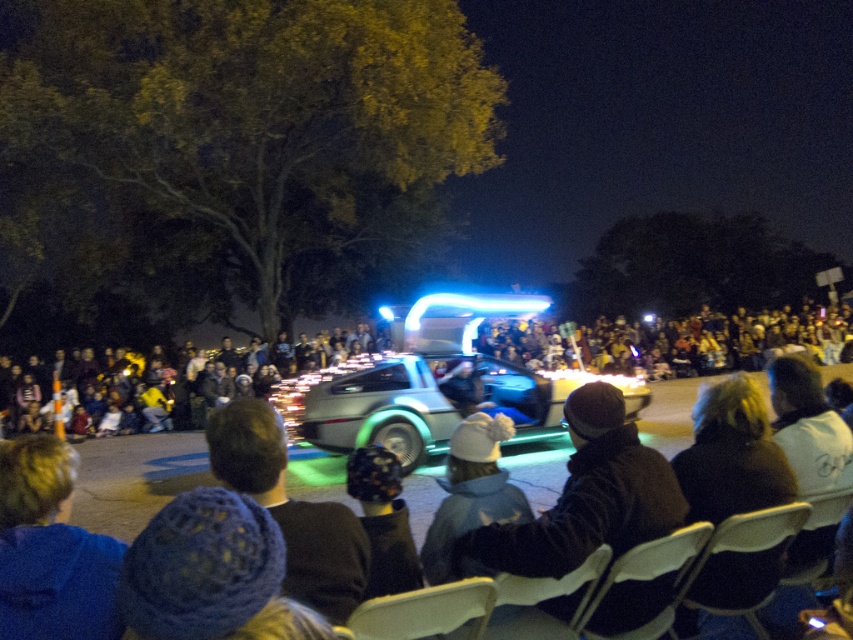
Question: Which object is farther from the camera taking this photo?

Choices:
 (A) blue knitted hat at lower center
 (B) knitted wool hat at center
 (C) white cotton shirt at lower right

Answer: (C)

Question: Does blue knitted hat at lower center have a larger size compared to white knit hat at center?

Choices:
 (A) no
 (B) yes

Answer: (B)

Question: Is dark clothing crowd at center bigger than white cotton shirt at lower right?

Choices:
 (A) yes
 (B) no

Answer: (A)

Question: Is dark knit hat at center above white cotton shirt at lower right?

Choices:
 (A) yes
 (B) no

Answer: (B)

Question: Which point is closer to the camera?

Choices:
 (A) blue knitted hat at lower center
 (B) knitted wool hat at center
 (C) white cotton shirt at lower right
 (D) blue knit hat at lower left

Answer: (A)

Question: Which point is farther to the camera?

Choices:
 (A) (776, 406)
 (B) (461, 488)
 (C) (137, 531)
 (D) (9, 548)

Answer: (C)